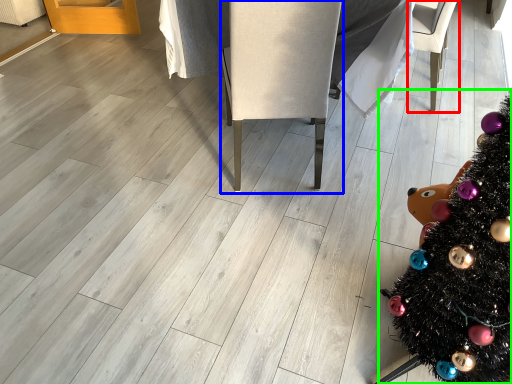
Question: Which is nearer to the armchair (highlighted by a red box)? armchair (highlighted by a blue box) or christmas tree (highlighted by a green box).

Choices:
 (A) armchair
 (B) christmas tree

Answer: (A)